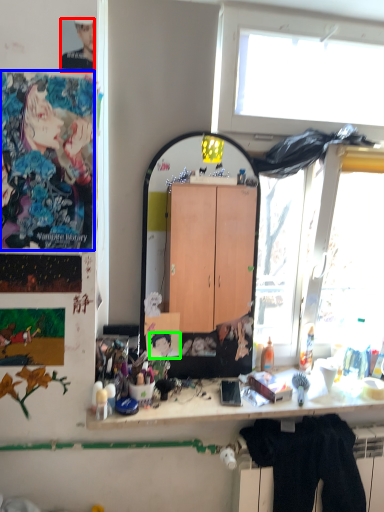
Question: Estimate the real-world distances between objects in this image. Which object is closer to person (highlighted by a red box), person (highlighted by a blue box) or person (highlighted by a green box)?

Choices:
 (A) person
 (B) person

Answer: (A)